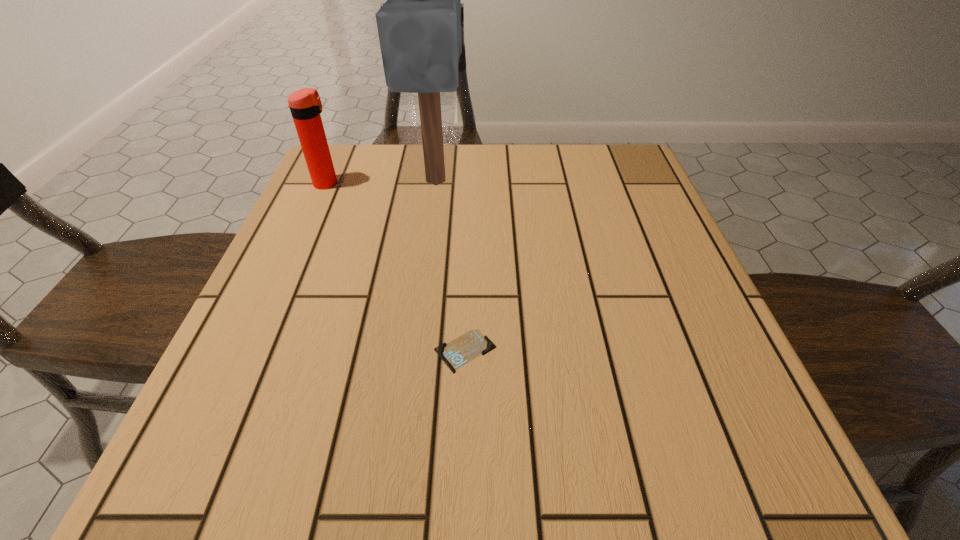
Locate an element on the screen. The image size is (960, 540). vacant region between the tallest object and the second shortest object is located at coordinates (382, 182).

Where is `vacant region between the identity card and the mallet`? vacant region between the identity card and the mallet is located at coordinates (450, 266).

I want to click on free area in between the tallest object and the nearest object, so click(x=450, y=266).

Find the location of `unoccupied area between the nearest object and the tallest object`. unoccupied area between the nearest object and the tallest object is located at coordinates (450, 266).

Where is `vacant space that's between the shortest object and the thermos bottle`? This screenshot has height=540, width=960. vacant space that's between the shortest object and the thermos bottle is located at coordinates (396, 267).

Identify the location of vacant area between the leftmost object and the mallet. This screenshot has width=960, height=540. (382, 182).

Identify the location of free space between the second tallest object and the shortest object. This screenshot has width=960, height=540. (396, 267).

Image resolution: width=960 pixels, height=540 pixels. What are the coordinates of `vacant area that lies between the tallest object and the nearest object` in the screenshot? It's located at (450, 266).

At what (x,y) coordinates should I click in order to perform the action: click on the closest object relative to the second shortest object. Please return your answer as a coordinate pair (x, y). The image size is (960, 540). Looking at the image, I should click on 419,26.

Locate an element on the screen. The image size is (960, 540). object that is the second closest one to the identity card is located at coordinates (305, 105).